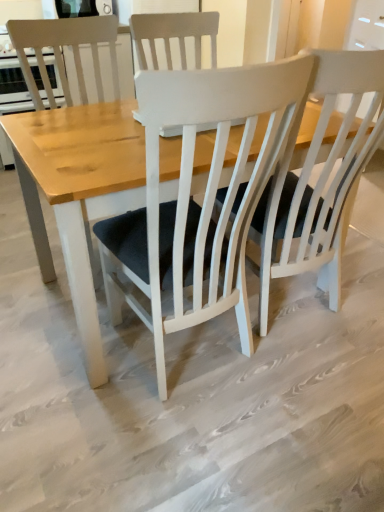
At what (x,y) coordinates should I click in order to perform the action: click on space that is in front of white wood chair at center. Please return your answer as a coordinate pair (x, y). Looking at the image, I should click on (63, 320).